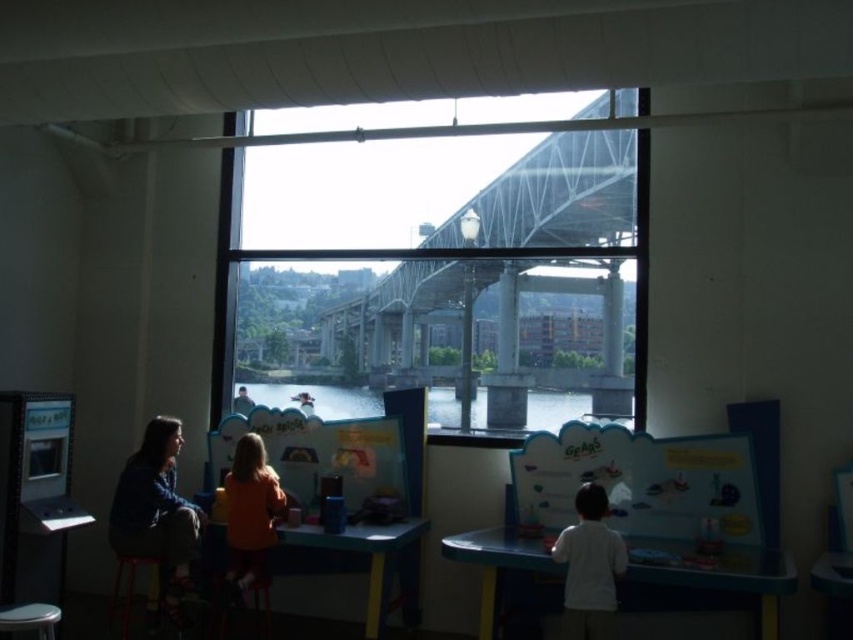
Is point (247, 513) in front of point (115, 577)?

Yes, it is in front of point (115, 577).

Between orange fabric jacket at center and matte red stool at lower left, which one is positioned higher?

orange fabric jacket at center is higher up.

The image size is (853, 640). I want to click on orange fabric jacket at center, so click(250, 513).

Between point (759, 616) and point (143, 497), which one is positioned behind?

The point (143, 497) is behind.

Identify the location of smooth plastic table at lower right. 718,572.

Where is `smooth plastic table at lower right`? smooth plastic table at lower right is located at coordinates (718, 572).

Does white matte shirt at lower right have a greater width compared to orange fabric jacket at center?

In fact, white matte shirt at lower right might be narrower than orange fabric jacket at center.

Find the location of a particular element. white matte shirt at lower right is located at coordinates (589, 566).